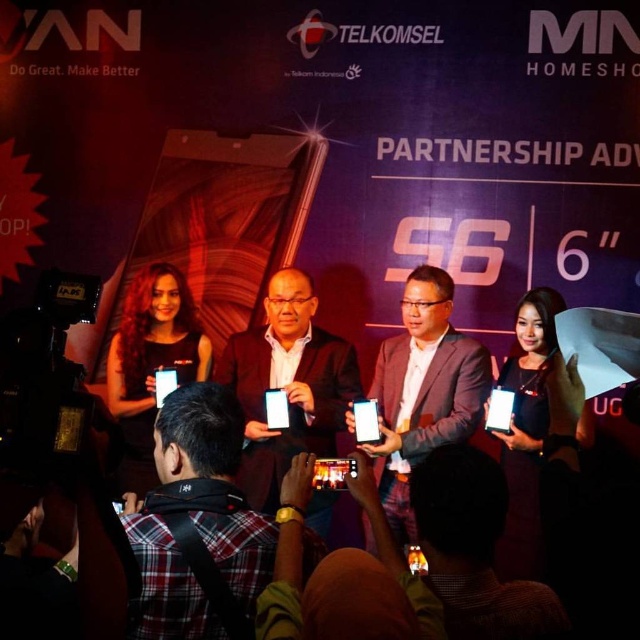
You are a photographer at the event and need to capture a photo of both the matte black phone at center and the matte black suit at center without any overlap. Given that your camera has a maximum focus range of 40 centimeters, will you be able to adjust your position to ensure both are in frame and in focus?

The distance between the matte black phone at center and the matte black suit at center is 43.27 centimeters. Since this exceeds the camera maximum focus range of 40 centimeters, you will not be able to capture both in focus simultaneously without adjusting your position or using other techniques.

You are a photographer at the event and need to capture a clear photo of both the plaid shirt at lower left and the matte black suit at center. Based on their positions, which one will appear closer to the camera in your photo?

The plaid shirt at lower left will appear closer to the camera in the photo because it is positioned in front of the matte black suit at center.